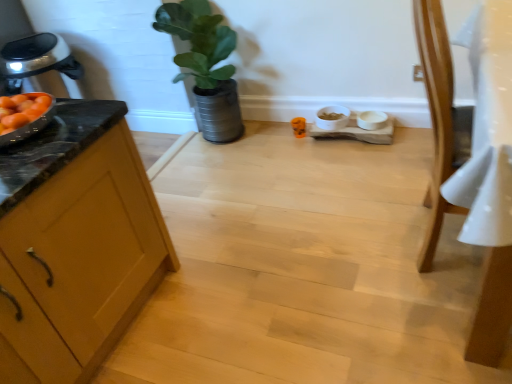
The image size is (512, 384). What are the coordinates of `green matte plant at upper center` in the screenshot? It's located at (206, 65).

What do you see at coordinates (77, 238) in the screenshot?
I see `wooden cabinet at left` at bounding box center [77, 238].

You are a GUI agent. You are given a task and a screenshot of the screen. Output one action in this format:
    pyautogui.click(x=<x>, y=<y>)
    Task: Click on the green matte plant at upper center
    The width and height of the screenshot is (512, 384).
    Given the screenshot: What is the action you would take?
    pyautogui.click(x=206, y=65)

From a real-world perspective, which object stands above the other?

green matte plant at upper center.

Is wooden cabinet at left in front of or behind green matte plant at upper center in the image?

Visually, wooden cabinet at left is located in front of green matte plant at upper center.

Who is shorter, wooden cabinet at left or green matte plant at upper center?

With less height is wooden cabinet at left.

Is wooden cabinet at left aimed at green matte plant at upper center?

No.

Considering the relative positions of light brown wooden chair at right and wooden cabinet at left in the image provided, is light brown wooden chair at right to the left of wooden cabinet at left from the viewer's perspective?

No.

How different are the orientations of light brown wooden chair at right and wooden cabinet at left in degrees?

Answer: The angle between the facing direction of light brown wooden chair at right and the facing direction of wooden cabinet at left is 180 degrees.

Which object is more forward, light brown wooden chair at right or wooden cabinet at left?

wooden cabinet at left is in front.

From the image's perspective, which one is positioned lower, light brown wooden chair at right or wooden cabinet at left?

wooden cabinet at left appears lower in the image.

Consider the image. Which is less distant, (422,254) or (230,44)?

The point (422,254) is closer to the camera.

Is there a large distance between light brown wooden chair at right and green matte plant at upper center?

light brown wooden chair at right is positioned a significant distance from green matte plant at upper center.

Who is bigger, light brown wooden chair at right or green matte plant at upper center?

With larger size is light brown wooden chair at right.

Which of these two, light brown wooden chair at right or green matte plant at upper center, stands taller?

light brown wooden chair at right is taller.

Considering the positions of objects green matte plant at upper center and wooden cabinet at left in the image provided, who is more to the left, green matte plant at upper center or wooden cabinet at left?

Positioned to the left is wooden cabinet at left.

Between green matte plant at upper center and wooden cabinet at left, which one has larger width?

Wider between the two is wooden cabinet at left.

Is the position of green matte plant at upper center less distant than that of wooden cabinet at left?

No, green matte plant at upper center is further to the viewer.

Where is `houseplant on the right of wooden cabinet at left`? houseplant on the right of wooden cabinet at left is located at coordinates (206, 65).

Is green matte plant at upper center taller than light brown wooden chair at right?

In fact, green matte plant at upper center may be shorter than light brown wooden chair at right.

Are green matte plant at upper center and light brown wooden chair at right beside each other?

There is a gap between green matte plant at upper center and light brown wooden chair at right.

From the image's perspective, is green matte plant at upper center below light brown wooden chair at right?

Incorrect, from the image's perspective, green matte plant at upper center is higher than light brown wooden chair at right.

In the image, is green matte plant at upper center on the left side or the right side of light brown wooden chair at right?

green matte plant at upper center is to the left of light brown wooden chair at right.

How many degrees apart are the facing directions of wooden cabinet at left and light brown wooden chair at right?

The angle between the facing direction of wooden cabinet at left and the facing direction of light brown wooden chair at right is 180 degrees.

How distant is wooden cabinet at left from light brown wooden chair at right?

The distance of wooden cabinet at left from light brown wooden chair at right is 3.48 feet.

From the image's perspective, is wooden cabinet at left on light brown wooden chair at right?

No, from the image's perspective, wooden cabinet at left is not on top of light brown wooden chair at right.

Which object is thinner, wooden cabinet at left or light brown wooden chair at right?

light brown wooden chair at right.

What are the coordinates of `houseplant behind the wooden cabinet at left` in the screenshot? It's located at (206, 65).

At what (x,y) coordinates should I click in order to perform the action: click on cabinetry lying in front of the light brown wooden chair at right. Please return your answer as a coordinate pair (x, y). The image size is (512, 384). Looking at the image, I should click on (77, 238).

Based on their spatial positions, is wooden cabinet at left or light brown wooden chair at right closer to green matte plant at upper center?

wooden cabinet at left.

Estimate the real-world distances between objects in this image. Which object is closer to wooden cabinet at left, light brown wooden chair at right or green matte plant at upper center?

light brown wooden chair at right lies closer to wooden cabinet at left than the other object.

Considering their positions, is green matte plant at upper center positioned closer to light brown wooden chair at right than wooden cabinet at left?

wooden cabinet at left is positioned closer to the anchor light brown wooden chair at right.

Considering their positions, is light brown wooden chair at right positioned further to green matte plant at upper center than wooden cabinet at left?

Based on the image, light brown wooden chair at right appears to be further to green matte plant at upper center.

Considering their positions, is green matte plant at upper center positioned closer to wooden cabinet at left than light brown wooden chair at right?

light brown wooden chair at right is closer to wooden cabinet at left.

When comparing their distances from light brown wooden chair at right, does wooden cabinet at left or green matte plant at upper center seem further?

The object further to light brown wooden chair at right is green matte plant at upper center.

At what (x,y) coordinates should I click in order to perform the action: click on houseplant situated between wooden cabinet at left and light brown wooden chair at right from left to right. Please return your answer as a coordinate pair (x, y). Looking at the image, I should click on (206, 65).